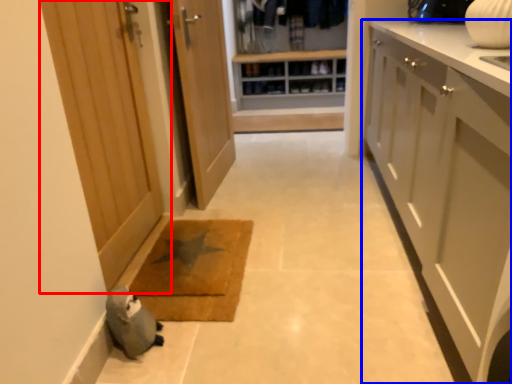
Question: Which point is further to the camera, door (highlighted by a red box) or cabinetry (highlighted by a blue box)?

Choices:
 (A) door
 (B) cabinetry

Answer: (A)